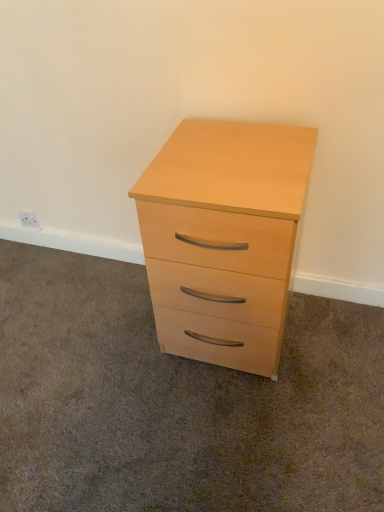
The image size is (384, 512). In order to click on free space above light wood drawer at center (from a real-world perspective) in this screenshot , I will do `click(127, 370)`.